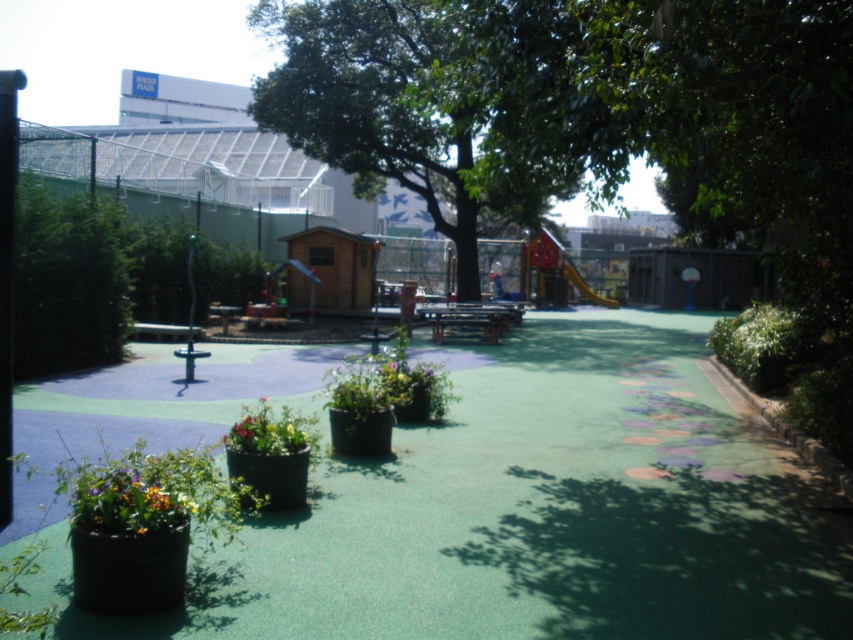
Can you confirm if glossy ceramic flower pot at lower left is wider than multicolored plastic flowers at center?

Incorrect, glossy ceramic flower pot at lower left's width does not surpass multicolored plastic flowers at center's.

This screenshot has width=853, height=640. Describe the element at coordinates (131, 500) in the screenshot. I see `glossy ceramic flower pot at lower left` at that location.

Identify the location of glossy ceramic flower pot at lower left. The width and height of the screenshot is (853, 640). (131, 500).

The height and width of the screenshot is (640, 853). Identify the location of glossy ceramic flower pot at lower left. (131, 500).